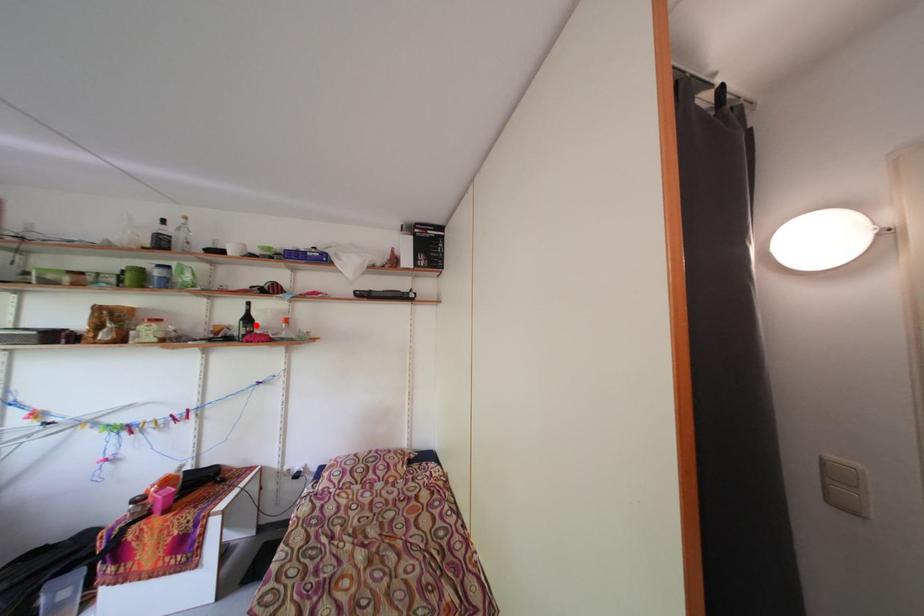
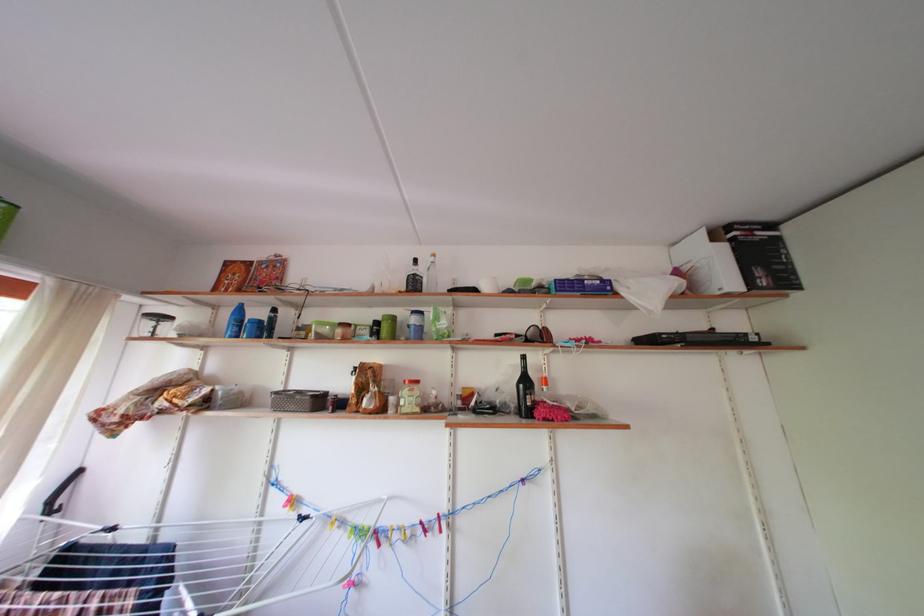
The point at the highlighted location is marked in the first image. Where is the corresponding point in the second image?

(533, 387)